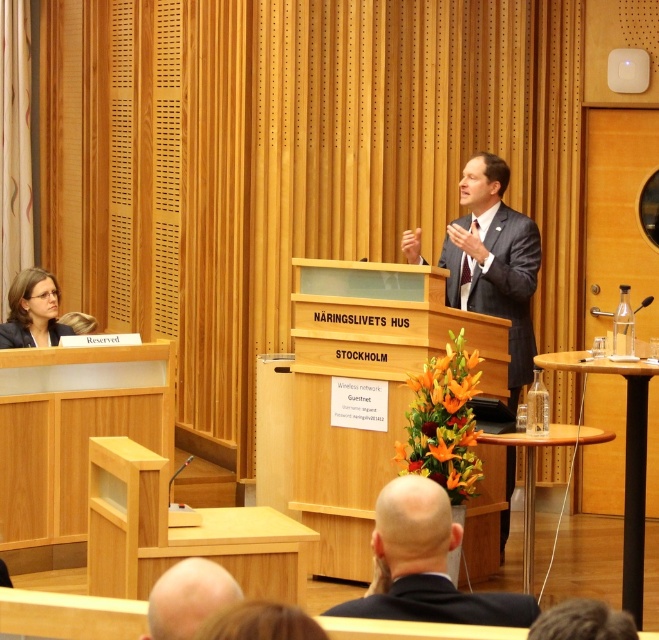
Which is above, bald head at lower center or matte black blazer at left?

matte black blazer at left is higher up.

Is point (186, 579) less distant than point (51, 332)?

That is True.

What are the coordinates of `bald head at lower center` in the screenshot? It's located at (188, 598).

What do you see at coordinates (32, 310) in the screenshot? Image resolution: width=659 pixels, height=640 pixels. I see `matte black suit at lower left` at bounding box center [32, 310].

Does matte black suit at lower left have a lesser width compared to matte black blazer at left?

Indeed, matte black suit at lower left has a lesser width compared to matte black blazer at left.

Who is more forward, (26, 339) or (13, 330)?

Point (13, 330)

Locate an element on the screen. This screenshot has width=659, height=640. matte black suit at lower left is located at coordinates (32, 310).

Is point (498, 621) farther from camera compared to point (355, 609)?

No.

Is the position of black suit at center more distant than that of black matte suit at lower center?

Yes, it is.

Is point (384, 580) farther from viewer compared to point (519, 625)?

Yes, point (384, 580) is behind point (519, 625).

Locate an element on the screen. black suit at center is located at coordinates (424, 564).